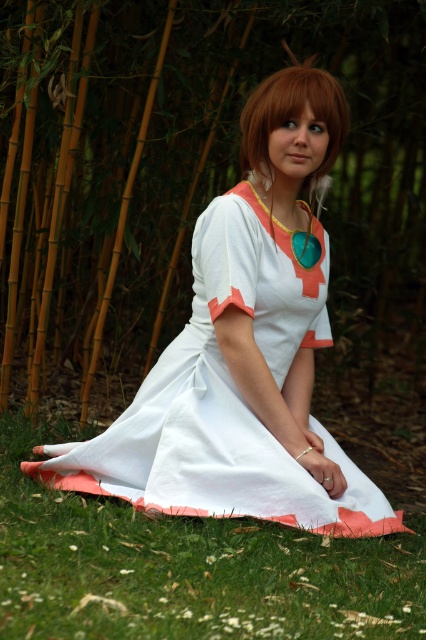
Question: Which object appears farthest from the camera in this image?

Choices:
 (A) blonde hair at center
 (B) white cotton dress at center
 (C) green grass at lower center

Answer: (A)

Question: Which object appears farthest from the camera in this image?

Choices:
 (A) white cotton dress at center
 (B) blonde hair at center

Answer: (B)

Question: Is white cotton dress at center to the left of blonde hair at center from the viewer's perspective?

Choices:
 (A) no
 (B) yes

Answer: (B)

Question: From the image, what is the correct spatial relationship of green grass at lower center in relation to blonde hair at center?

Choices:
 (A) above
 (B) below

Answer: (B)

Question: Is green grass at lower center bigger than blonde hair at center?

Choices:
 (A) yes
 (B) no

Answer: (A)

Question: Which point is closer to the camera?

Choices:
 (A) blonde hair at center
 (B) green grass at lower center
 (C) white cotton dress at center

Answer: (B)